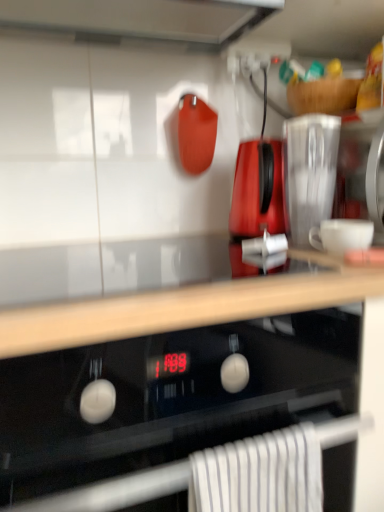
The image size is (384, 512). Find the location of `translucent plastic blender at center, the first kitchen appliance when ordered from right to left`. translucent plastic blender at center, the first kitchen appliance when ordered from right to left is located at coordinates (309, 172).

What do you see at coordinates (155, 290) in the screenshot?
I see `wooden at upper center` at bounding box center [155, 290].

In order to face wooden at upper center, should I rotate leftwards or rightwards?

You should rotate left by 7.255 degrees.

Image resolution: width=384 pixels, height=512 pixels. What do you see at coordinates (255, 193) in the screenshot?
I see `glossy plastic kettle at center, which ranks as the first kitchen appliance in left-to-right order` at bounding box center [255, 193].

Identify the location of translucent plastic blender at center, the first kitchen appliance when ordered from right to left. (309, 172).

Which of these two, black glass oven at center or wooden at upper center, is smaller?

With smaller size is wooden at upper center.

Considering the relative sizes of black glass oven at center and wooden at upper center in the image provided, is black glass oven at center taller than wooden at upper center?

Correct, black glass oven at center is much taller as wooden at upper center.

Do you think black glass oven at center is within wooden at upper center, or outside of it?

black glass oven at center is spatially situated outside wooden at upper center.

Considering the sizes of objects black glass oven at center and wooden at upper center in the image provided, who is thinner, black glass oven at center or wooden at upper center?

wooden at upper center is thinner.

Considering the relative sizes of black glass oven at center and translucent plastic blender at center, which is the 2th kitchen appliance in left-to-right order, in the image provided, is black glass oven at center shorter than translucent plastic blender at center, which is the 2th kitchen appliance in left-to-right order,?

No, black glass oven at center is not shorter than translucent plastic blender at center, which is the 2th kitchen appliance in left-to-right order.

From a real-world perspective, does black glass oven at center stand above translucent plastic blender at center, the first kitchen appliance when ordered from right to left?

No, from a real-world perspective, black glass oven at center is not on top of translucent plastic blender at center, the first kitchen appliance when ordered from right to left.

What's the angular difference between black glass oven at center and translucent plastic blender at center, which is the 2th kitchen appliance in left-to-right order,'s facing directions?

2.75e-05 degrees.

Which object is closer to the camera taking this photo, wooden at upper center or translucent plastic blender at center, which is the 2th kitchen appliance in left-to-right order?

wooden at upper center is closer to the camera.

The height and width of the screenshot is (512, 384). There is a wooden at upper center. Identify the location of the 2nd kitchen appliance above it (from a real-world perspective). (309, 172).

Considering the sizes of objects wooden at upper center and translucent plastic blender at center, the first kitchen appliance when ordered from right to left, in the image provided, who is thinner, wooden at upper center or translucent plastic blender at center, the first kitchen appliance when ordered from right to left,?

translucent plastic blender at center, the first kitchen appliance when ordered from right to left.

From a real-world perspective, between glossy plastic kettle at center, which ranks as the first kitchen appliance in left-to-right order, and white striped towel at lower center, who is vertically higher?

From a 3D spatial view, glossy plastic kettle at center, which ranks as the first kitchen appliance in left-to-right order, is above.

From the image's perspective, is glossy plastic kettle at center, which ranks as the first kitchen appliance in left-to-right order, located beneath white striped towel at lower center?

No, from the image's perspective, glossy plastic kettle at center, which ranks as the first kitchen appliance in left-to-right order, is not beneath white striped towel at lower center.

Who is smaller, glossy plastic kettle at center, arranged as the 2th kitchen appliance when viewed from the right, or white striped towel at lower center?

white striped towel at lower center is smaller.

Considering the positions of objects white striped towel at lower center and translucent plastic blender at center, which is the 2th kitchen appliance in left-to-right order, in the image provided, who is behind, white striped towel at lower center or translucent plastic blender at center, which is the 2th kitchen appliance in left-to-right order,?

translucent plastic blender at center, which is the 2th kitchen appliance in left-to-right order.

From a real-world perspective, is white striped towel at lower center physically located above or below translucent plastic blender at center, the first kitchen appliance when ordered from right to left?

From a real-world perspective, white striped towel at lower center is physically below translucent plastic blender at center, the first kitchen appliance when ordered from right to left.

Between white striped towel at lower center and translucent plastic blender at center, which is the 2th kitchen appliance in left-to-right order, which one has larger width?

Wider between the two is translucent plastic blender at center, which is the 2th kitchen appliance in left-to-right order.

From the picture: Is white striped towel at lower center at the left side of translucent plastic blender at center, the first kitchen appliance when ordered from right to left?

Correct, you'll find white striped towel at lower center to the left of translucent plastic blender at center, the first kitchen appliance when ordered from right to left.

Is glossy plastic kettle at center, arranged as the 2th kitchen appliance when viewed from the right, further to the viewer compared to translucent plastic blender at center, which is the 2th kitchen appliance in left-to-right order?

Yes, glossy plastic kettle at center, arranged as the 2th kitchen appliance when viewed from the right, is behind translucent plastic blender at center, which is the 2th kitchen appliance in left-to-right order.

Are glossy plastic kettle at center, arranged as the 2th kitchen appliance when viewed from the right, and translucent plastic blender at center, the first kitchen appliance when ordered from right to left, located far from each other?

Actually, glossy plastic kettle at center, arranged as the 2th kitchen appliance when viewed from the right, and translucent plastic blender at center, the first kitchen appliance when ordered from right to left, are a little close together.

Between glossy plastic kettle at center, arranged as the 2th kitchen appliance when viewed from the right, and translucent plastic blender at center, the first kitchen appliance when ordered from right to left, which one appears on the right side from the viewer's perspective?

Positioned to the right is translucent plastic blender at center, the first kitchen appliance when ordered from right to left.

Is glossy plastic kettle at center, which ranks as the first kitchen appliance in left-to-right order, not inside translucent plastic blender at center, the first kitchen appliance when ordered from right to left?

Yes, glossy plastic kettle at center, which ranks as the first kitchen appliance in left-to-right order, is located beyond the bounds of translucent plastic blender at center, the first kitchen appliance when ordered from right to left.

From the image's perspective, is wooden at upper center located above or below glossy plastic kettle at center, which ranks as the first kitchen appliance in left-to-right order?

From the image's perspective, wooden at upper center appears below glossy plastic kettle at center, which ranks as the first kitchen appliance in left-to-right order.

Locate an element on the screen. The height and width of the screenshot is (512, 384). countertop below the glossy plastic kettle at center, arranged as the 2th kitchen appliance when viewed from the right (from the image's perspective) is located at coordinates (155, 290).

From a real-world perspective, is wooden at upper center physically located above or below glossy plastic kettle at center, arranged as the 2th kitchen appliance when viewed from the right?

Clearly, from a real-world perspective, wooden at upper center is below glossy plastic kettle at center, arranged as the 2th kitchen appliance when viewed from the right.

Where is `countertop located above the black glass oven at center (from the image's perspective)`? countertop located above the black glass oven at center (from the image's perspective) is located at coordinates (155, 290).

Where is `oven in front of the translucent plastic blender at center, which is the 2th kitchen appliance in left-to-right order`? oven in front of the translucent plastic blender at center, which is the 2th kitchen appliance in left-to-right order is located at coordinates (168, 397).

Estimate the real-world distances between objects in this image. Which object is further from black glass oven at center, wooden at upper center or glossy plastic kettle at center, arranged as the 2th kitchen appliance when viewed from the right?

Among the two, glossy plastic kettle at center, arranged as the 2th kitchen appliance when viewed from the right, is located further to black glass oven at center.

When comparing their distances from glossy plastic kettle at center, which ranks as the first kitchen appliance in left-to-right order, does wooden at upper center or black glass oven at center seem closer?

wooden at upper center lies closer to glossy plastic kettle at center, which ranks as the first kitchen appliance in left-to-right order, than the other object.

Based on their spatial positions, is glossy plastic kettle at center, arranged as the 2th kitchen appliance when viewed from the right, or wooden at upper center further from translucent plastic blender at center, the first kitchen appliance when ordered from right to left?

wooden at upper center.

When comparing their distances from glossy plastic kettle at center, arranged as the 2th kitchen appliance when viewed from the right, does translucent plastic blender at center, which is the 2th kitchen appliance in left-to-right order, or wooden at upper center seem further?

wooden at upper center is further to glossy plastic kettle at center, arranged as the 2th kitchen appliance when viewed from the right.

From the image, which object appears to be nearer to glossy plastic kettle at center, arranged as the 2th kitchen appliance when viewed from the right, translucent plastic blender at center, which is the 2th kitchen appliance in left-to-right order, or black glass oven at center?

Based on the image, translucent plastic blender at center, which is the 2th kitchen appliance in left-to-right order, appears to be nearer to glossy plastic kettle at center, arranged as the 2th kitchen appliance when viewed from the right.

Considering their positions, is wooden at upper center positioned closer to translucent plastic blender at center, which is the 2th kitchen appliance in left-to-right order, than black glass oven at center?

Among the two, wooden at upper center is located nearer to translucent plastic blender at center, which is the 2th kitchen appliance in left-to-right order.

Looking at this image, when comparing their distances from translucent plastic blender at center, the first kitchen appliance when ordered from right to left, does white striped towel at lower center or black glass oven at center seem further?

The object further to translucent plastic blender at center, the first kitchen appliance when ordered from right to left, is white striped towel at lower center.

Which object lies nearer to the anchor point glossy plastic kettle at center, which ranks as the first kitchen appliance in left-to-right order, translucent plastic blender at center, which is the 2th kitchen appliance in left-to-right order, or white striped towel at lower center?

translucent plastic blender at center, which is the 2th kitchen appliance in left-to-right order, is closer to glossy plastic kettle at center, which ranks as the first kitchen appliance in left-to-right order.

You are a GUI agent. You are given a task and a screenshot of the screen. Output one action in this format:
    pyautogui.click(x=<x>, y=<y>)
    Task: Click on the kitchen appliance between wooden at upper center and glossy plastic kettle at center, which ranks as the first kitchen appliance in left-to-right order, in the front-back direction
    The width and height of the screenshot is (384, 512).
    Given the screenshot: What is the action you would take?
    pyautogui.click(x=309, y=172)

The image size is (384, 512). Find the location of `countertop between translucent plastic blender at center, which is the 2th kitchen appliance in left-to-right order, and black glass oven at center, in the vertical direction`. countertop between translucent plastic blender at center, which is the 2th kitchen appliance in left-to-right order, and black glass oven at center, in the vertical direction is located at coordinates click(155, 290).

You are a GUI agent. You are given a task and a screenshot of the screen. Output one action in this format:
    pyautogui.click(x=<x>, y=<y>)
    Task: Click on the oven between translucent plastic blender at center, the first kitchen appliance when ordered from right to left, and white striped towel at lower center from top to bottom
    This screenshot has width=384, height=512.
    Given the screenshot: What is the action you would take?
    pyautogui.click(x=168, y=397)

Identify the location of kitchen appliance that lies between glossy plastic kettle at center, which ranks as the first kitchen appliance in left-to-right order, and white striped towel at lower center from top to bottom. The width and height of the screenshot is (384, 512). (309, 172).